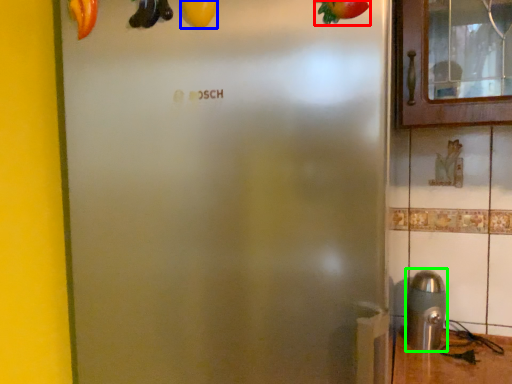
Question: Estimate the real-world distances between objects in this image. Which object is closer to fruit (highlighted by a red box), fruit (highlighted by a blue box) or stainless steel (highlighted by a green box)?

Choices:
 (A) fruit
 (B) stainless steel

Answer: (A)